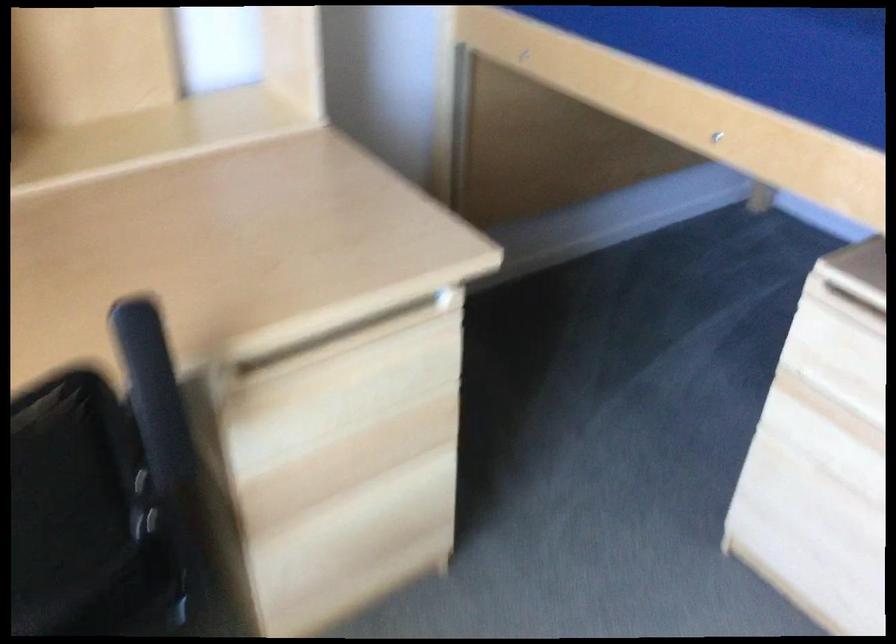
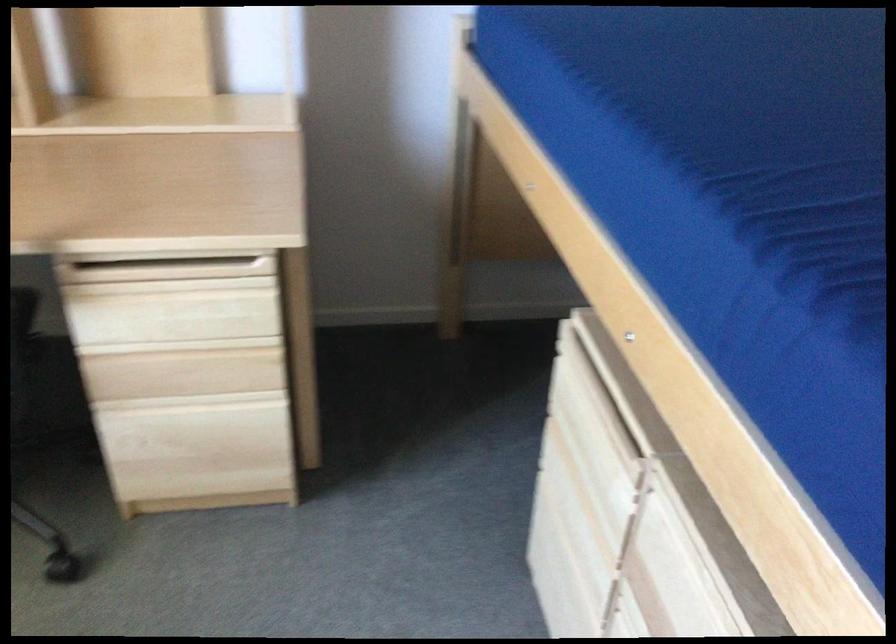
Find the pixel in the second image that matches point (356, 342) in the first image.

(166, 270)